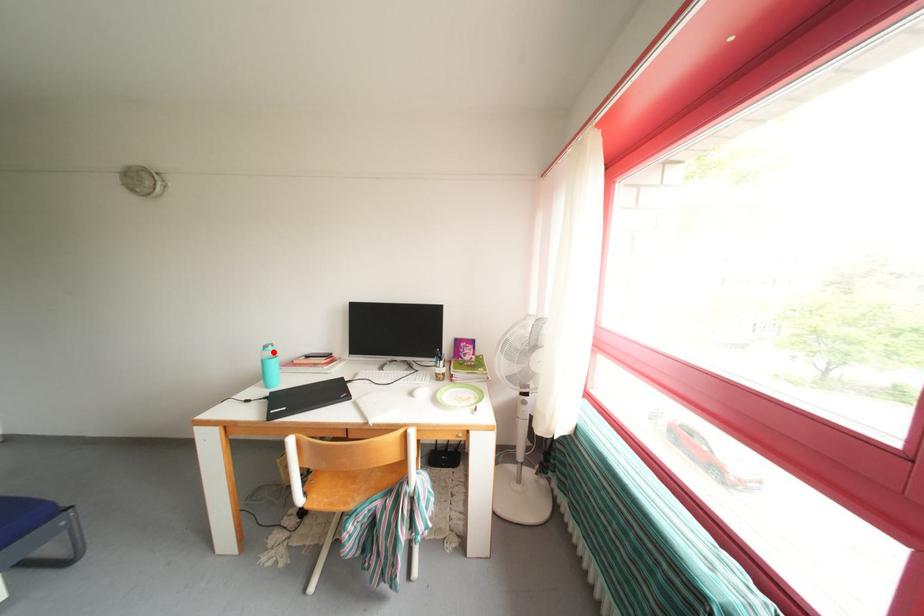
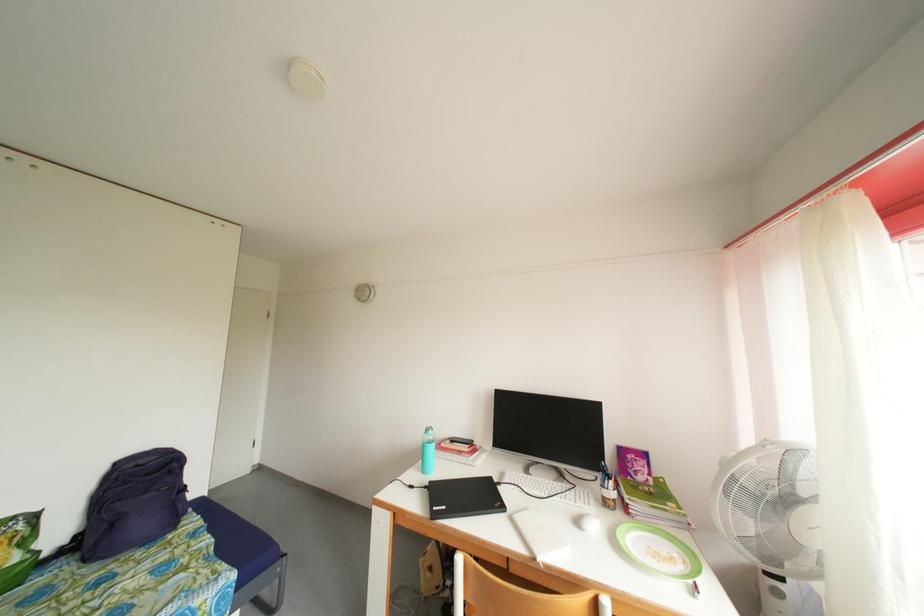
The point at the highlighted location is marked in the first image. Where is the corresponding point in the second image?

(434, 436)